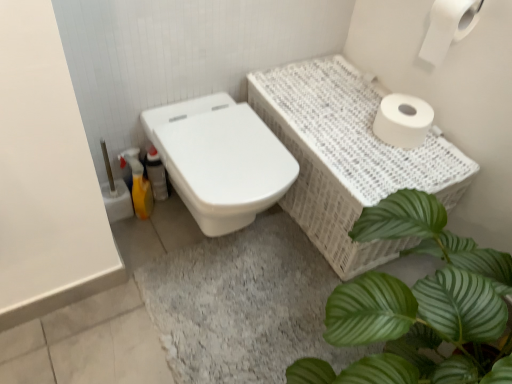
Question: Can you confirm if translucent plastic bottle at lower left is wider than yellow plastic bottle at lower left?

Choices:
 (A) yes
 (B) no

Answer: (B)

Question: Is translucent plastic bottle at lower left not close to yellow plastic bottle at lower left?

Choices:
 (A) yes
 (B) no

Answer: (B)

Question: Could you tell me if translucent plastic bottle at lower left is turned towards yellow plastic bottle at lower left?

Choices:
 (A) yes
 (B) no

Answer: (B)

Question: From the image's perspective, is translucent plastic bottle at lower left located above yellow plastic bottle at lower left?

Choices:
 (A) no
 (B) yes

Answer: (B)

Question: Does translucent plastic bottle at lower left have a larger size compared to yellow plastic bottle at lower left?

Choices:
 (A) yes
 (B) no

Answer: (B)

Question: Considering the relative sizes of translucent plastic bottle at lower left and yellow plastic bottle at lower left in the image provided, is translucent plastic bottle at lower left taller than yellow plastic bottle at lower left?

Choices:
 (A) no
 (B) yes

Answer: (A)

Question: Considering the relative sizes of yellow plastic bottle at lower left and white matte toilet paper at upper right, which appears as the first toilet paper when ordered from the bottom, in the image provided, is yellow plastic bottle at lower left shorter than white matte toilet paper at upper right, which appears as the first toilet paper when ordered from the bottom,?

Choices:
 (A) no
 (B) yes

Answer: (A)

Question: Does yellow plastic bottle at lower left turn towards white matte toilet paper at upper right, the second toilet paper from the top?

Choices:
 (A) no
 (B) yes

Answer: (A)

Question: From a real-world perspective, is yellow plastic bottle at lower left over white matte toilet paper at upper right, the second toilet paper from the top?

Choices:
 (A) no
 (B) yes

Answer: (A)

Question: From a real-world perspective, does yellow plastic bottle at lower left sit lower than white matte toilet paper at upper right, the second toilet paper from the top?

Choices:
 (A) no
 (B) yes

Answer: (B)

Question: Does yellow plastic bottle at lower left come behind white matte toilet paper at upper right, the second toilet paper from the top?

Choices:
 (A) yes
 (B) no

Answer: (A)

Question: Is yellow plastic bottle at lower left looking in the opposite direction of white matte toilet paper at upper right, which appears as the first toilet paper when ordered from the bottom?

Choices:
 (A) no
 (B) yes

Answer: (A)

Question: Considering the relative sizes of white matte toilet paper at upper right, positioned as the 2th toilet paper in bottom-to-top order, and yellow plastic bottle at lower left in the image provided, is white matte toilet paper at upper right, positioned as the 2th toilet paper in bottom-to-top order, thinner than yellow plastic bottle at lower left?

Choices:
 (A) no
 (B) yes

Answer: (A)